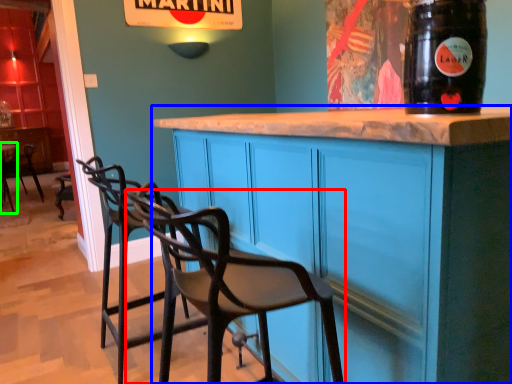
Question: Considering the real-world distances, which object is closest to chair (highlighted by a red box)? cabinetry (highlighted by a blue box) or table (highlighted by a green box).

Choices:
 (A) cabinetry
 (B) table

Answer: (A)